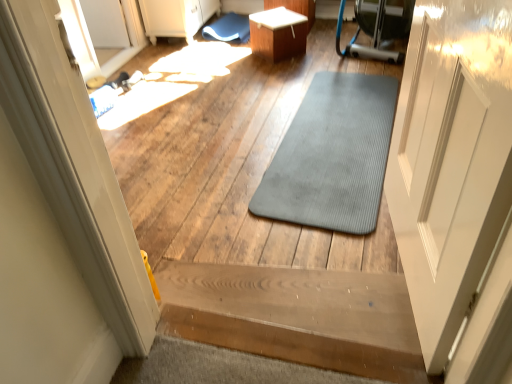
Image resolution: width=512 pixels, height=384 pixels. What are the coordinates of `free spot above white glossy table at upper center (from a real-world perspective)` in the screenshot? It's located at (274, 19).